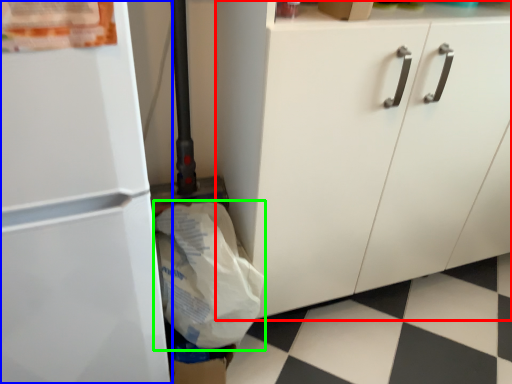
Question: Which object is positioned closest to cabinetry (highlighted by a red box)? Select from refrigerator (highlighted by a blue box) and grocery bag (highlighted by a green box).

Choices:
 (A) refrigerator
 (B) grocery bag

Answer: (B)